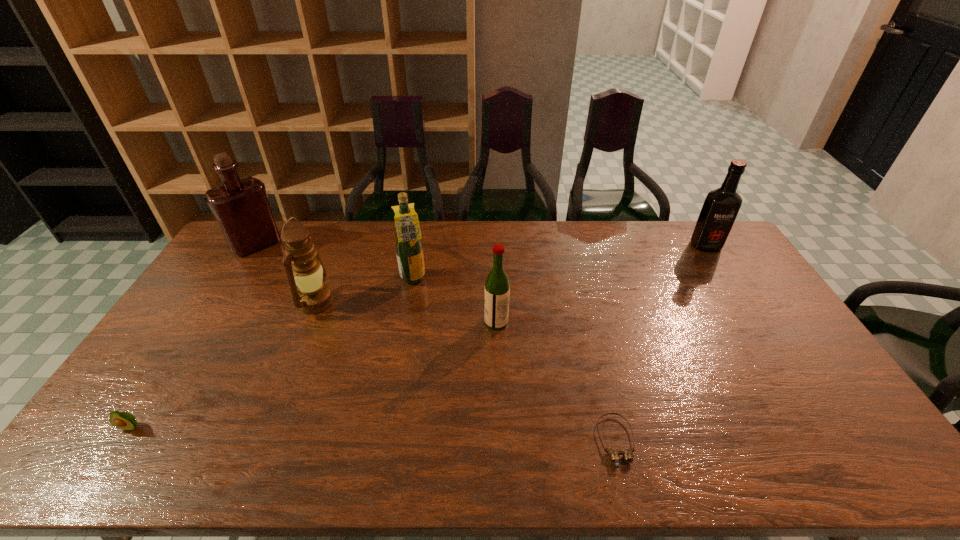
Locate an element on the screen. The image size is (960, 540). the leftmost liquor is located at coordinates (241, 207).

You are a GUI agent. You are given a task and a screenshot of the screen. Output one action in this format:
    pyautogui.click(x=<x>, y=<y>)
    Task: Click on the rightmost liquor
    
    Given the screenshot: What is the action you would take?
    click(721, 206)

Where is `the third liquor from right to left`? the third liquor from right to left is located at coordinates (409, 250).

In order to click on the fourth object from left to right in this screenshot , I will do tap(409, 250).

This screenshot has height=540, width=960. What are the coordinates of `oil lamp` in the screenshot? It's located at (312, 296).

At what (x,y) coordinates should I click in order to perform the action: click on the third liquor from left to right. Please return your answer as a coordinate pair (x, y). Looking at the image, I should click on point(497,286).

The width and height of the screenshot is (960, 540). I want to click on the nearest liquor, so click(497, 286).

Identify the location of avocado. (122, 420).

Find the location of `the shortest object`. the shortest object is located at coordinates (614, 454).

Where is `the second object from right to left`? the second object from right to left is located at coordinates (614, 454).